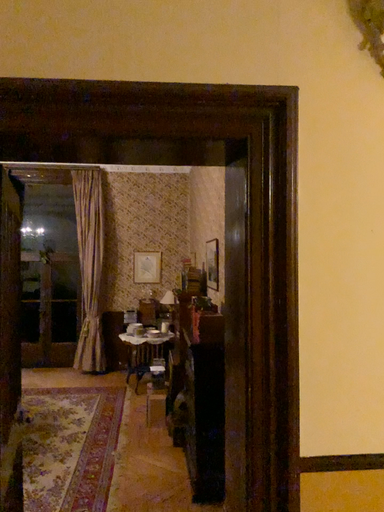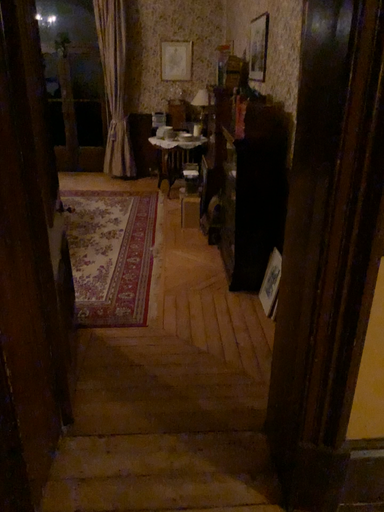
Question: Which way did the camera rotate in the video?

Choices:
 (A) rotated downward
 (B) rotated upward

Answer: (A)